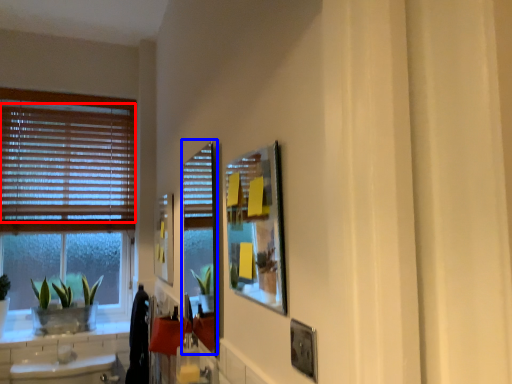
Question: Which object is closer to the camera taking this photo, blind (highlighted by a red box) or screen door (highlighted by a blue box)?

Choices:
 (A) blind
 (B) screen door

Answer: (B)